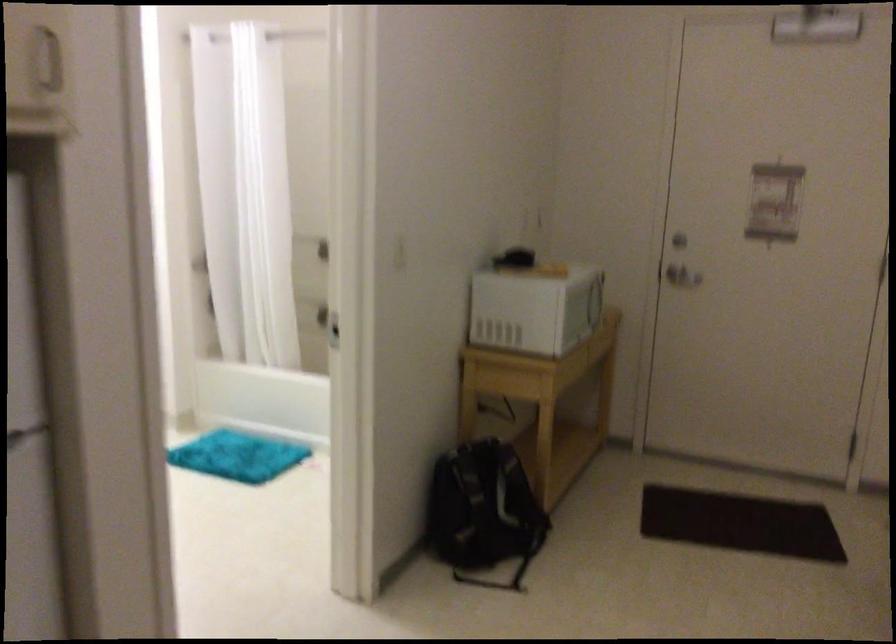
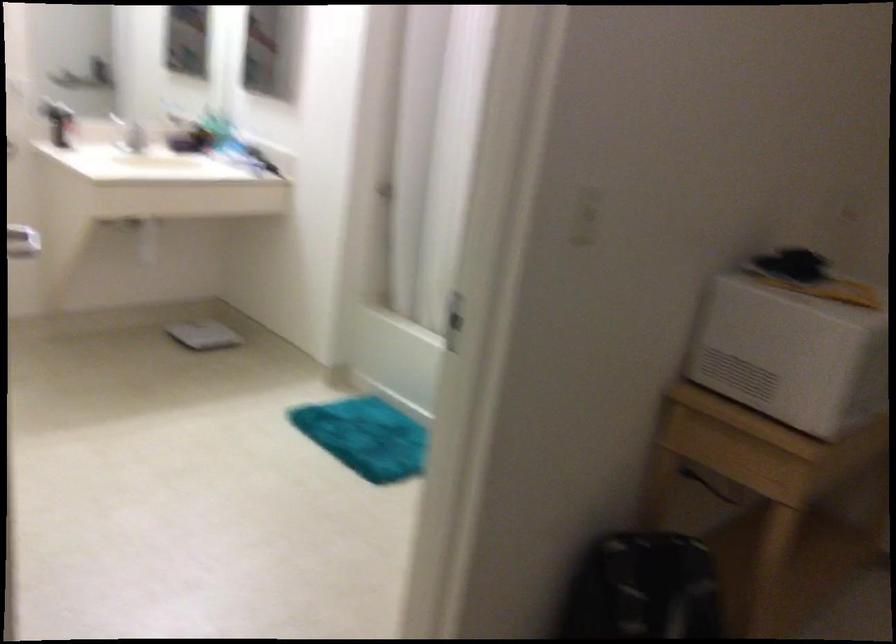
Question: The images are taken continuously from a first-person perspective. In which direction are you moving?

Choices:
 (A) Left
 (B) Right
 (C) Forward
 (D) Backward

Answer: (C)